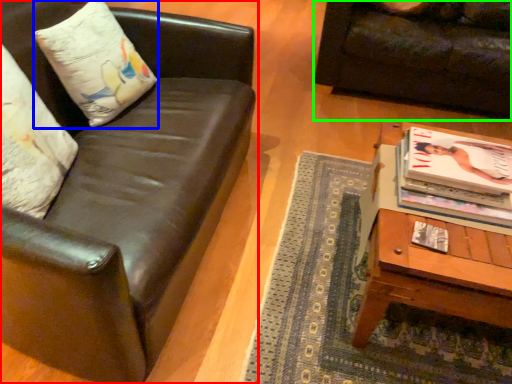
Question: Estimate the real-world distances between objects in this image. Which object is farther from studio couch (highlighted by a red box), pillow (highlighted by a blue box) or studio couch (highlighted by a green box)?

Choices:
 (A) pillow
 (B) studio couch

Answer: (B)